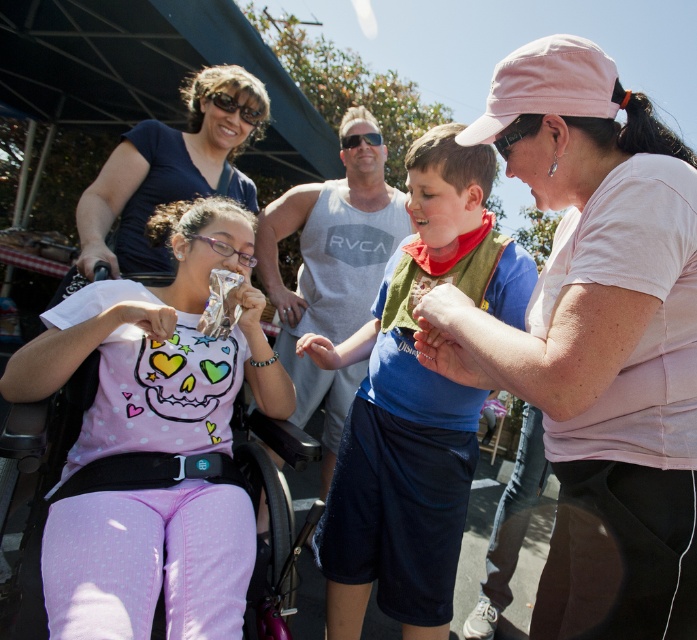
You are a fashion designer observing the image. You need to decide which item can be folded more easily based on their material thickness. Which one between the pink cotton cap at upper right and the pink matte shirt at center is thinner?

The pink cotton cap at upper right is thinner than the pink matte shirt at center, so it can be folded more easily.

What object is located at the coordinates point (597, 340)?

The pink cotton cap at upper right is located at point (597, 340).